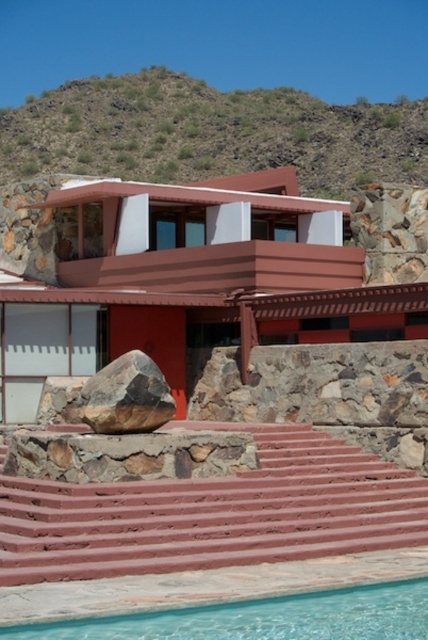
Does smooth terracotta stairs at center have a larger size compared to brown rough rock at lower center?

Yes.

Who is more forward, (x=404, y=512) or (x=127, y=376)?

Point (x=127, y=376)

The height and width of the screenshot is (640, 428). Identify the location of smooth terracotta stairs at center. (214, 513).

Who is shorter, matte red stone villa at center or smooth terracotta stairs at center?

smooth terracotta stairs at center

What do you see at coordinates (198, 273) in the screenshot? I see `matte red stone villa at center` at bounding box center [198, 273].

At what (x,y) coordinates should I click in order to perform the action: click on matte red stone villa at center. Please return your answer as a coordinate pair (x, y). The image size is (428, 640). Looking at the image, I should click on (198, 273).

Looking at this image, is the position of smooth terracotta stairs at center less distant than that of clear glass pool at lower center?

No, smooth terracotta stairs at center is further to the viewer.

Measure the distance between smooth terracotta stairs at center and camera.

The distance of smooth terracotta stairs at center from camera is 21.00 meters.

Locate an element on the screen. smooth terracotta stairs at center is located at coordinates (214, 513).